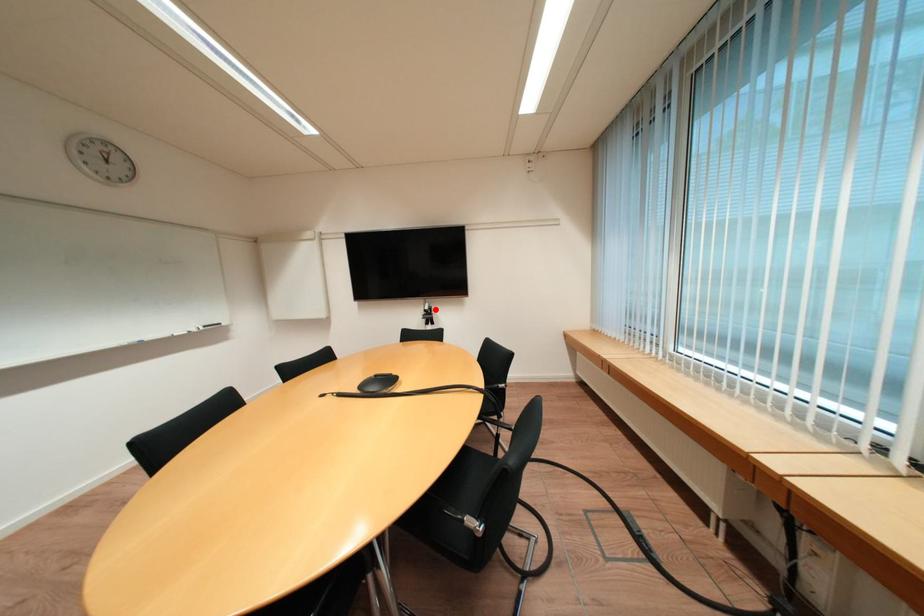
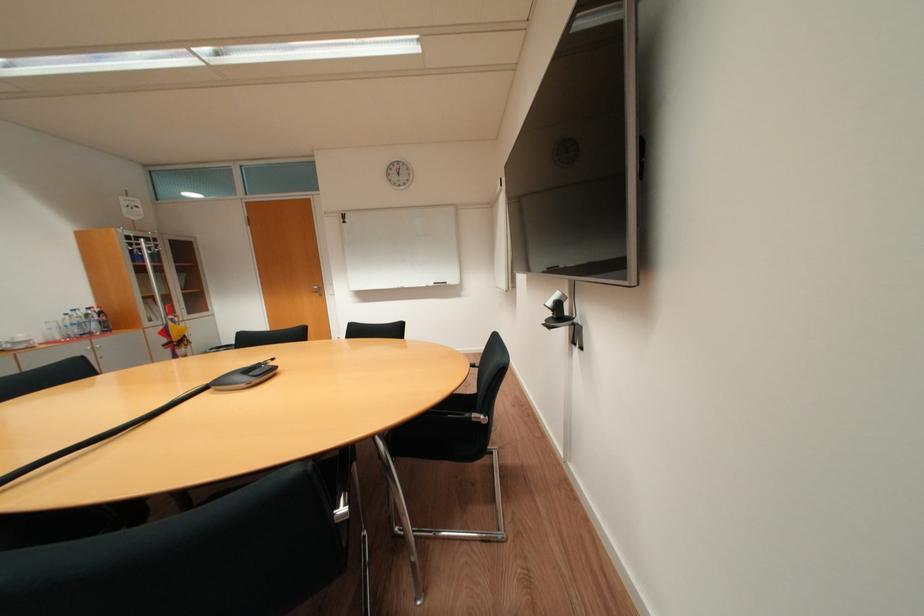
Find the pixel in the second image that matches the highlighted location in the first image.

(558, 304)